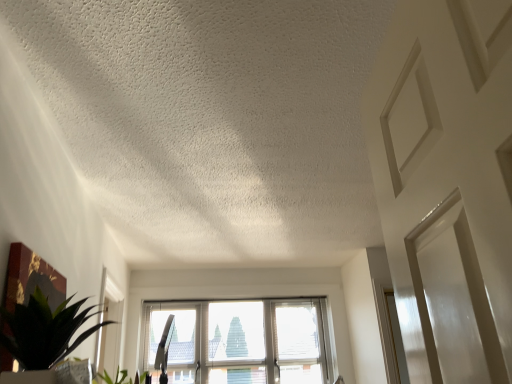
The height and width of the screenshot is (384, 512). Describe the element at coordinates (45, 331) in the screenshot. I see `green leafy plant at lower left` at that location.

Identify the location of green leafy plant at lower left. (45, 331).

What is the approximate width of green leafy plant at lower left?

12.32 inches.

In order to face green leafy plant at lower left, should I rotate leftwards or rightwards?

A 26.127 degree turn to the left will do.

Find the location of a particular element. Image resolution: width=512 pixels, height=384 pixels. transparent glass window at center is located at coordinates (241, 341).

Image resolution: width=512 pixels, height=384 pixels. What do you see at coordinates (241, 341) in the screenshot?
I see `transparent glass window at center` at bounding box center [241, 341].

This screenshot has height=384, width=512. In order to click on green leafy plant at lower left in this screenshot , I will do `click(45, 331)`.

In the scene shown: Is transparent glass window at center to the left or to the right of green leafy plant at lower left in the image?

Based on their positions, transparent glass window at center is located to the right of green leafy plant at lower left.

Which object is more forward, transparent glass window at center or green leafy plant at lower left?

Positioned in front is green leafy plant at lower left.

Which is nearer, (244, 360) or (77, 329)?

Point (244, 360) appears to be farther away from the viewer than point (77, 329).

From the image's perspective, which is above, transparent glass window at center or green leafy plant at lower left?

From the image's view, green leafy plant at lower left is above.

From a real-world perspective, who is located higher, transparent glass window at center or green leafy plant at lower left?

transparent glass window at center is physically above.

Considering the relative sizes of transparent glass window at center and green leafy plant at lower left in the image provided, is transparent glass window at center thinner than green leafy plant at lower left?

Correct, the width of transparent glass window at center is less than that of green leafy plant at lower left.

From their relative heights in the image, would you say transparent glass window at center is taller or shorter than green leafy plant at lower left?

Considering their sizes, transparent glass window at center has more height than green leafy plant at lower left.

Which of these two, transparent glass window at center or green leafy plant at lower left, is bigger?

transparent glass window at center.

Is transparent glass window at center not inside green leafy plant at lower left?

Yes.

Is transparent glass window at center far from green leafy plant at lower left?

Absolutely, transparent glass window at center is distant from green leafy plant at lower left.

Could you tell me if transparent glass window at center is turned towards green leafy plant at lower left?

Yes, transparent glass window at center is facing green leafy plant at lower left.

This screenshot has height=384, width=512. In order to click on houseplant in front of the transparent glass window at center in this screenshot , I will do `click(45, 331)`.

Consider the image. Is green leafy plant at lower left at the right side of transparent glass window at center?

No.

Consider the image. Is green leafy plant at lower left positioned behind transparent glass window at center?

No, green leafy plant at lower left is in front of transparent glass window at center.

Between point (28, 348) and point (188, 378), which one is positioned behind?

Point (188, 378)

From the image's perspective, between green leafy plant at lower left and transparent glass window at center, who is located below?

From the image's view, transparent glass window at center is below.

From a real-world perspective, is green leafy plant at lower left positioned above or below transparent glass window at center?

green leafy plant at lower left is situated lower than transparent glass window at center in the real world.

Between green leafy plant at lower left and transparent glass window at center, which one has smaller width?

Thinner between the two is transparent glass window at center.

Between green leafy plant at lower left and transparent glass window at center, which one has more height?

transparent glass window at center.

Considering the sizes of objects green leafy plant at lower left and transparent glass window at center in the image provided, who is bigger, green leafy plant at lower left or transparent glass window at center?

Bigger between the two is transparent glass window at center.

Is green leafy plant at lower left not inside transparent glass window at center?

Yes.

Is the surface of green leafy plant at lower left in direct contact with transparent glass window at center?

green leafy plant at lower left and transparent glass window at center are clearly separated.

Looking at this image, is green leafy plant at lower left aimed at transparent glass window at center?

No, green leafy plant at lower left does not turn towards transparent glass window at center.

How different are the orientations of green leafy plant at lower left and transparent glass window at center in degrees?

94 degrees separate the facing orientations of green leafy plant at lower left and transparent glass window at center.

Find the location of a particular element. The image size is (512, 384). window below the green leafy plant at lower left (from the image's perspective) is located at coordinates (241, 341).

Locate an element on the screen. The image size is (512, 384). houseplant in front of the transparent glass window at center is located at coordinates [x=45, y=331].

This screenshot has height=384, width=512. Find the location of `window on the right of green leafy plant at lower left`. window on the right of green leafy plant at lower left is located at coordinates (241, 341).